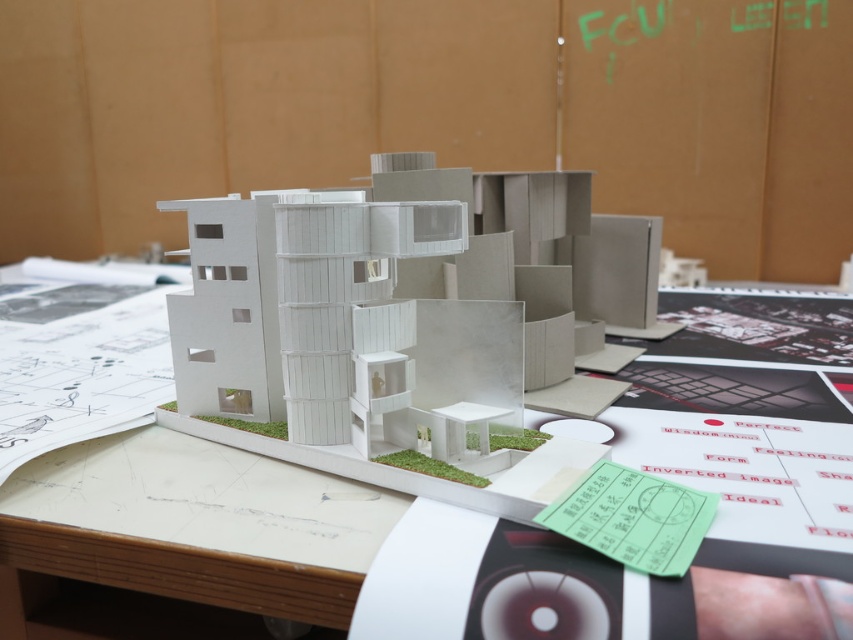
Between white cardboard building at center and white paper at center, which one has more height?

white cardboard building at center

What do you see at coordinates (404, 307) in the screenshot? I see `white cardboard building at center` at bounding box center [404, 307].

This screenshot has width=853, height=640. Find the location of `white cardboard building at center`. white cardboard building at center is located at coordinates (404, 307).